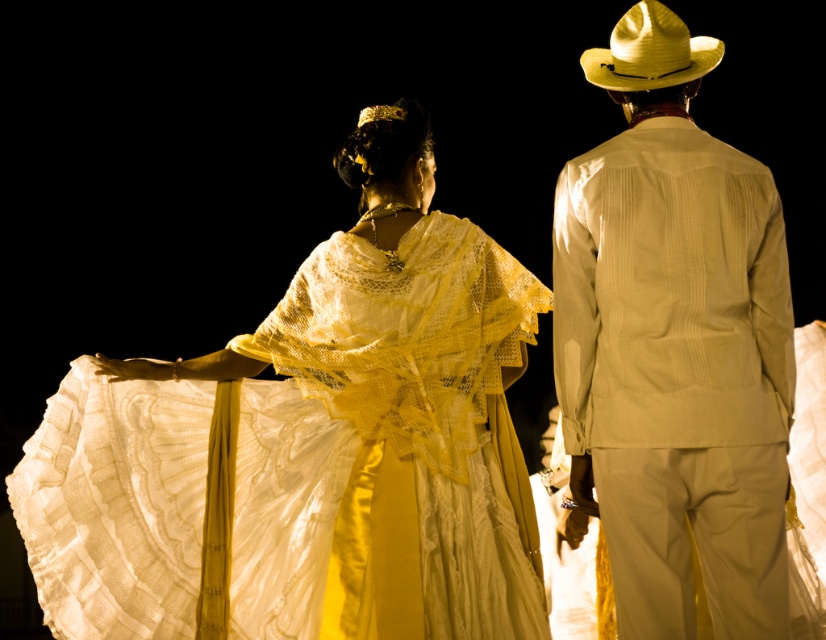
Can you confirm if light beige textured suit at right is positioned to the left of straw cowboy hat at upper right?

Indeed, light beige textured suit at right is positioned on the left side of straw cowboy hat at upper right.

Is point (692, 627) more distant than point (663, 20)?

No, (692, 627) is in front of (663, 20).

What do you see at coordinates (675, 346) in the screenshot? Image resolution: width=826 pixels, height=640 pixels. I see `light beige textured suit at right` at bounding box center [675, 346].

At what (x,y) coordinates should I click in order to perform the action: click on light beige textured suit at right. Please return your answer as a coordinate pair (x, y). This screenshot has width=826, height=640. Looking at the image, I should click on [675, 346].

Who is shorter, matte white lace dress at center or straw cowboy hat at upper right?

straw cowboy hat at upper right is shorter.

Is matte white lace dress at center wider than straw cowboy hat at upper right?

Indeed, matte white lace dress at center has a greater width compared to straw cowboy hat at upper right.

Locate an element on the screen. matte white lace dress at center is located at coordinates (305, 464).

Find the location of `matte white lace dress at center`. matte white lace dress at center is located at coordinates (305, 464).

What do you see at coordinates (305, 464) in the screenshot? Image resolution: width=826 pixels, height=640 pixels. I see `matte white lace dress at center` at bounding box center [305, 464].

Who is shorter, matte white lace dress at center or light beige textured suit at right?

light beige textured suit at right is shorter.

Is point (293, 461) more distant than point (609, 412)?

Yes, it is.

Find the location of a particular element. matte white lace dress at center is located at coordinates pyautogui.click(x=305, y=464).